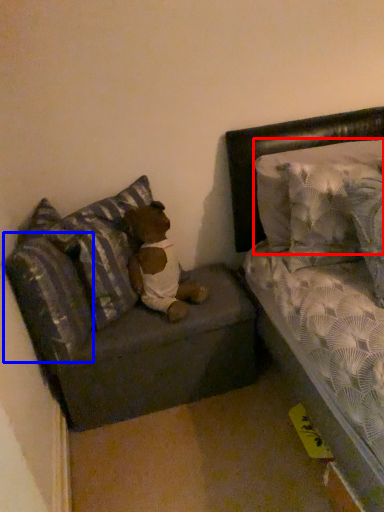
Question: Which point is further to the camera, pillow (highlighted by a red box) or pillow (highlighted by a blue box)?

Choices:
 (A) pillow
 (B) pillow

Answer: (A)